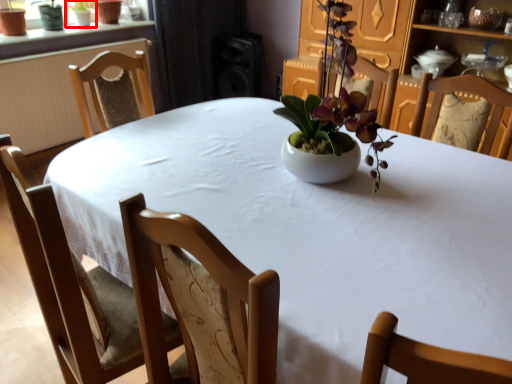
Question: Considering the relative positions of houseplant (annotated by the red box) and speaker in the image provided, where is houseplant (annotated by the red box) located with respect to the staircase?

Choices:
 (A) left
 (B) right

Answer: (A)